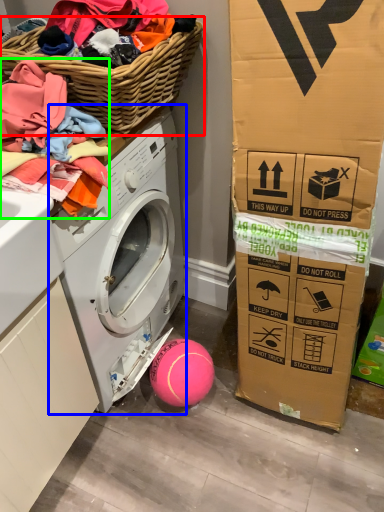
Question: Which object is the closest to the basket (highlighted by a red box)? Choose among these: washing machine (highlighted by a blue box) or clothing (highlighted by a green box).

Choices:
 (A) washing machine
 (B) clothing

Answer: (B)